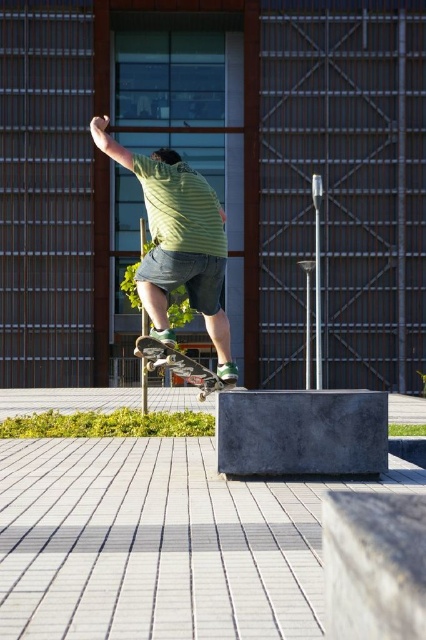
You are a photographer trying to capture the skateboarder in midair. You notice the green striped shirt at upper center and the wooden skateboard at center. Which object is located higher in the image?

The green striped shirt at upper center is positioned over the wooden skateboard at center, meaning it is higher up in the image.